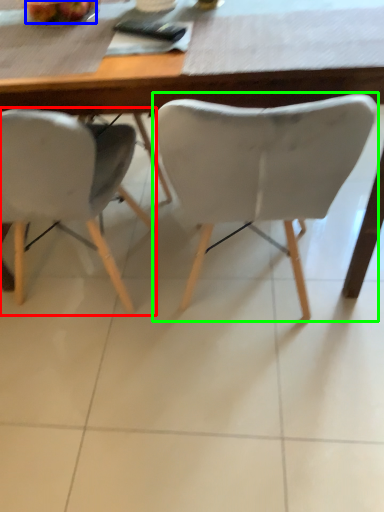
Question: Which is nearer to the chair (highlighted by a red box)? fruit (highlighted by a blue box) or chair (highlighted by a green box).

Choices:
 (A) fruit
 (B) chair

Answer: (B)